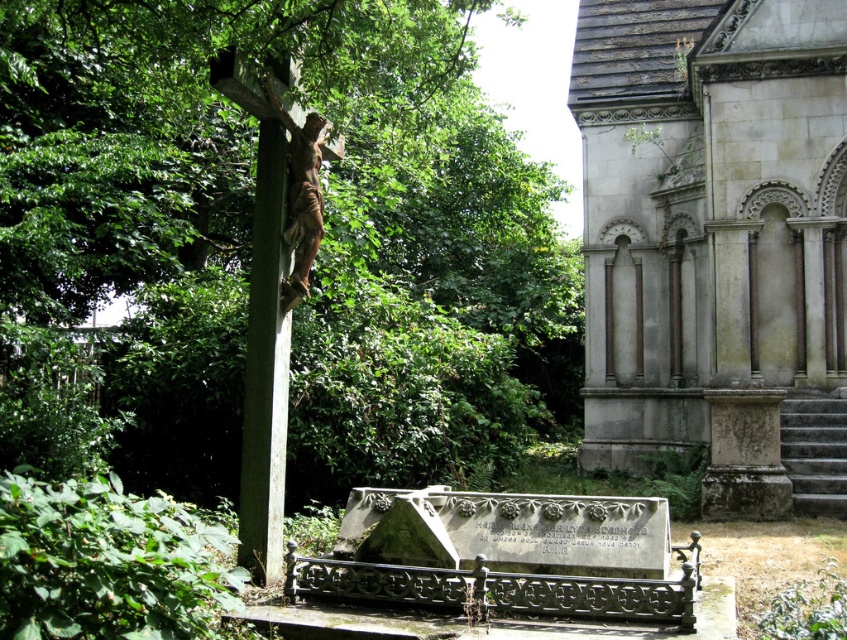
Between gray stone church at right and green stone cross at left, which one appears on the left side from the viewer's perspective?

From the viewer's perspective, green stone cross at left appears more on the left side.

This screenshot has width=847, height=640. I want to click on gray stone church at right, so [717, 243].

Does point (250, 340) come farther from viewer compared to point (275, 96)?

That is True.

Who is more distant from viewer, (278, 342) or (316, 188)?

Point (316, 188)

Image resolution: width=847 pixels, height=640 pixels. What do you see at coordinates (264, 368) in the screenshot?
I see `green stone cross at left` at bounding box center [264, 368].

Locate an element on the screen. The image size is (847, 640). green stone cross at left is located at coordinates (264, 368).

Who is higher up, green leafy tree at left or bronze statue at center?

green leafy tree at left is higher up.

Who is positioned more to the right, green leafy tree at left or bronze statue at center?

From the viewer's perspective, green leafy tree at left appears more on the right side.

Between point (236, 198) and point (297, 189), which one is positioned in front?

Positioned in front is point (297, 189).

Where is `green leafy tree at left`? This screenshot has height=640, width=847. green leafy tree at left is located at coordinates pyautogui.click(x=250, y=248).